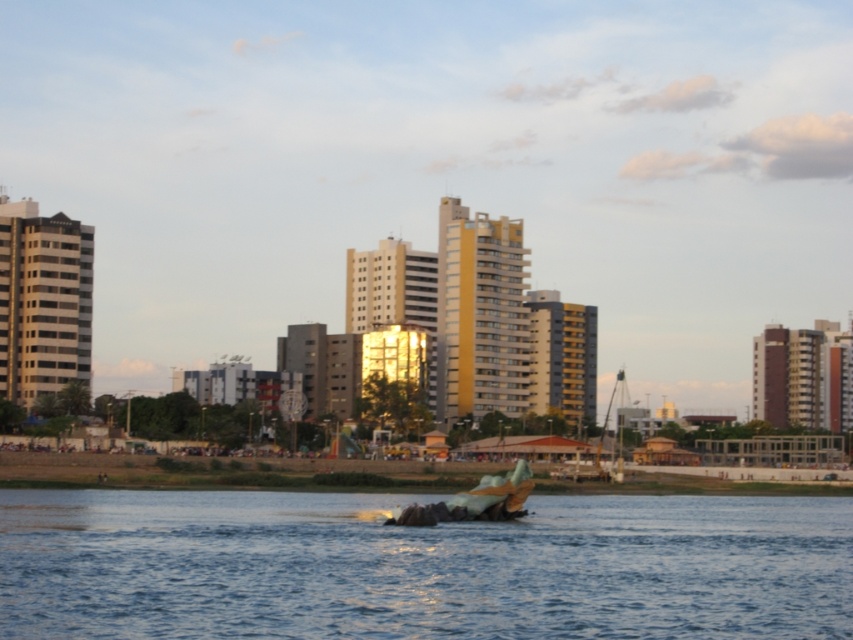
You are standing on the smooth concrete shoreline at center and want to reach the blue water at center. Which direction should you move to get there?

Since the blue water at center is to the left of the smooth concrete shoreline at center, you should move to your left to reach the blue water at center.

You are standing at the waterfront and want to take a photo of the blue water at center. Which direction should you face to capture it in your shot?

The blue water at center is located at point (421, 566), so you should face towards the middle of the water to capture it in your shot.